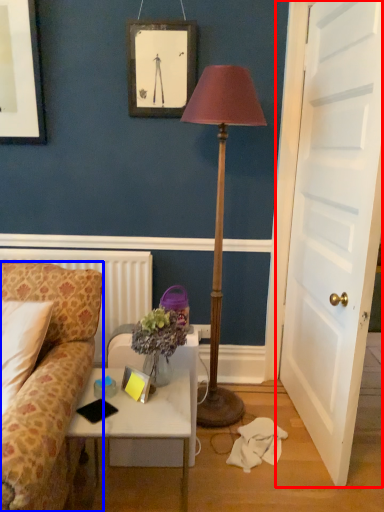
Question: Which object is further to the camera taking this photo, door (highlighted by a red box) or studio couch (highlighted by a blue box)?

Choices:
 (A) door
 (B) studio couch

Answer: (B)